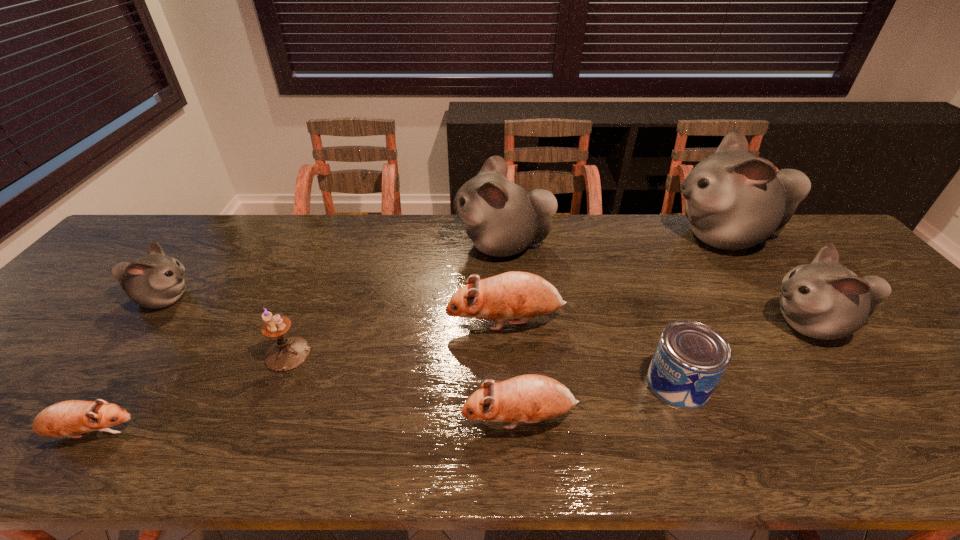
This screenshot has height=540, width=960. In order to click on free space located 0.130m on the front label of the third object from right to left in this screenshot , I will do `click(589, 383)`.

At what (x,y) coordinates should I click in order to perform the action: click on free space located 0.330m on the front label of the third object from right to left. Please return your answer as a coordinate pair (x, y). The image size is (960, 540). Looking at the image, I should click on (499, 383).

I want to click on vacant region located 0.080m at the face of the sixth tallest hamster, so click(x=423, y=418).

Find the location of `blank space located at the face of the sixth tallest hamster`. blank space located at the face of the sixth tallest hamster is located at coordinates (347, 418).

Where is `vacant region located at the face of the sixth tallest hamster`? Image resolution: width=960 pixels, height=540 pixels. vacant region located at the face of the sixth tallest hamster is located at coordinates (323, 418).

You are a GUI agent. You are given a task and a screenshot of the screen. Output one action in this format:
    pyautogui.click(x=<x>, y=<y>)
    Task: Click on the vacant region located at the face of the smallest brown hamster
    The image size is (960, 540).
    Given the screenshot: What is the action you would take?
    pyautogui.click(x=200, y=434)

Locate an element on the screen. The height and width of the screenshot is (540, 960). object that is at the far right corner is located at coordinates (734, 200).

Find the location of a particular element. vacant space at the far edge of the desktop is located at coordinates (365, 225).

In the image, there is a desktop. Where is `vacant space at the near edge`? The width and height of the screenshot is (960, 540). vacant space at the near edge is located at coordinates (532, 436).

The width and height of the screenshot is (960, 540). In the image, there is a desktop. In order to click on vacant space at the left edge in this screenshot , I will do `click(84, 291)`.